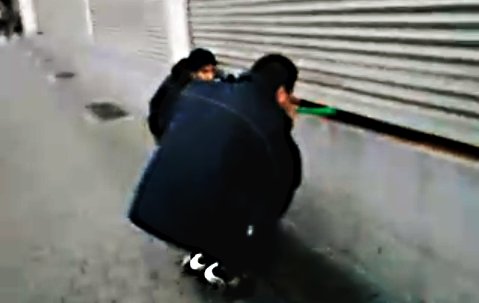
Locate an element on the screen. This screenshot has width=479, height=303. gray cement ground is located at coordinates (50, 167).